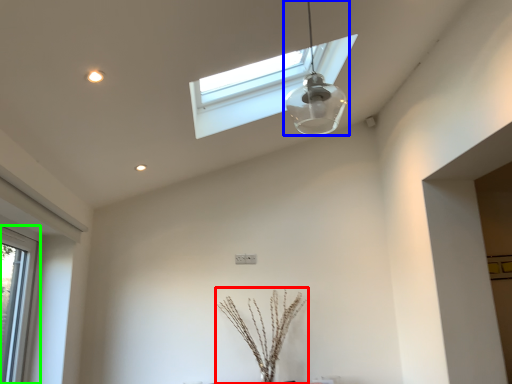
Question: Which object is the closest to the plant (highlighted by a red box)? Choose among these: lamp (highlighted by a blue box) or window (highlighted by a green box).

Choices:
 (A) lamp
 (B) window

Answer: (B)